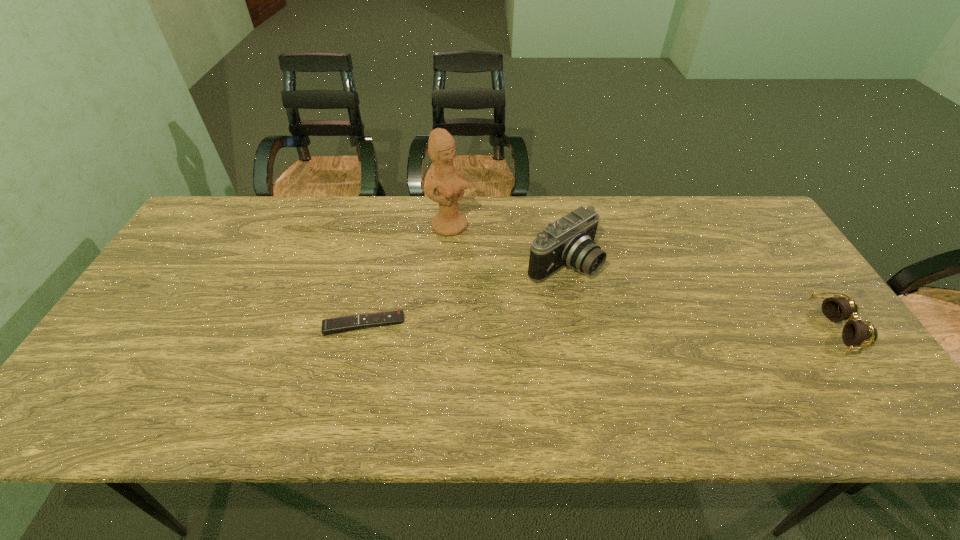
Image resolution: width=960 pixels, height=540 pixels. Identify the location of vacant region that satisfies the following two spatial constraints: 1. on the back side of the remote control; 2. on the right side of the third shortest object. (378, 262).